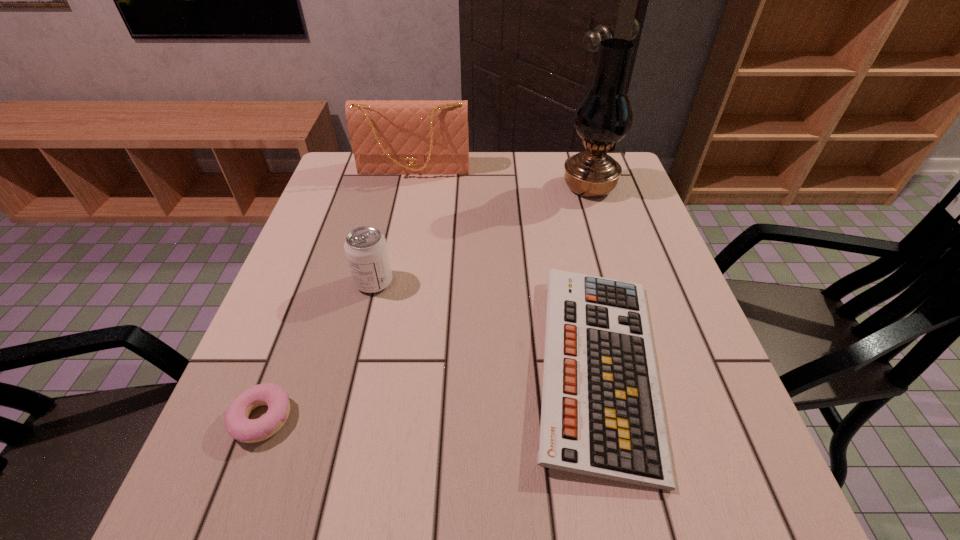
Find the location of `oil lamp that is at the far edge`. oil lamp that is at the far edge is located at coordinates (604, 116).

This screenshot has height=540, width=960. Identify the location of handbag situated at the far edge. (422, 137).

Identify the location of object that is at the near edge. (601, 414).

Where is `handbag at the left edge`? The image size is (960, 540). handbag at the left edge is located at coordinates (422, 137).

The image size is (960, 540). In order to click on soda can that is at the left edge in this screenshot , I will do `click(366, 249)`.

The height and width of the screenshot is (540, 960). I want to click on doughnut present at the left edge, so click(238, 426).

At what (x,y) coordinates should I click in order to perform the action: click on oil lamp present at the right edge. Please return your answer as a coordinate pair (x, y). The width and height of the screenshot is (960, 540). Looking at the image, I should click on (604, 116).

You are a GUI agent. You are given a task and a screenshot of the screen. Output one action in this format:
    pyautogui.click(x=<x>, y=<y>)
    Task: Click on the computer keyboard that is at the right edge
    The image size is (960, 540).
    Given the screenshot: What is the action you would take?
    pyautogui.click(x=601, y=414)

You are a GUI agent. You are given a task and a screenshot of the screen. Output one action in this format:
    pyautogui.click(x=<x>, y=<y>)
    Task: Click on the object that is at the far left corner
    
    Given the screenshot: What is the action you would take?
    pyautogui.click(x=422, y=137)

Locate an element on the screen. This screenshot has height=540, width=960. object that is at the far right corner is located at coordinates (604, 116).